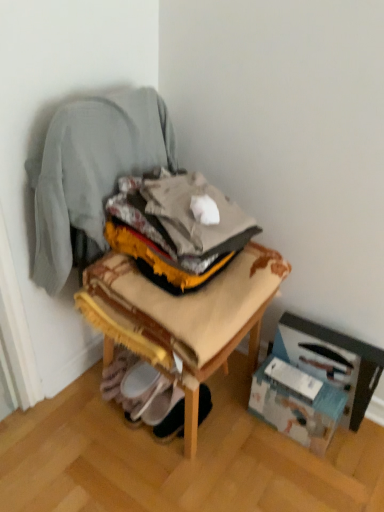
Where is `vacant region in front of white cardboard box at lower right, marked as the 2th cardboard box in a left-to-right arrangement`? The image size is (384, 512). vacant region in front of white cardboard box at lower right, marked as the 2th cardboard box in a left-to-right arrangement is located at coordinates (326, 465).